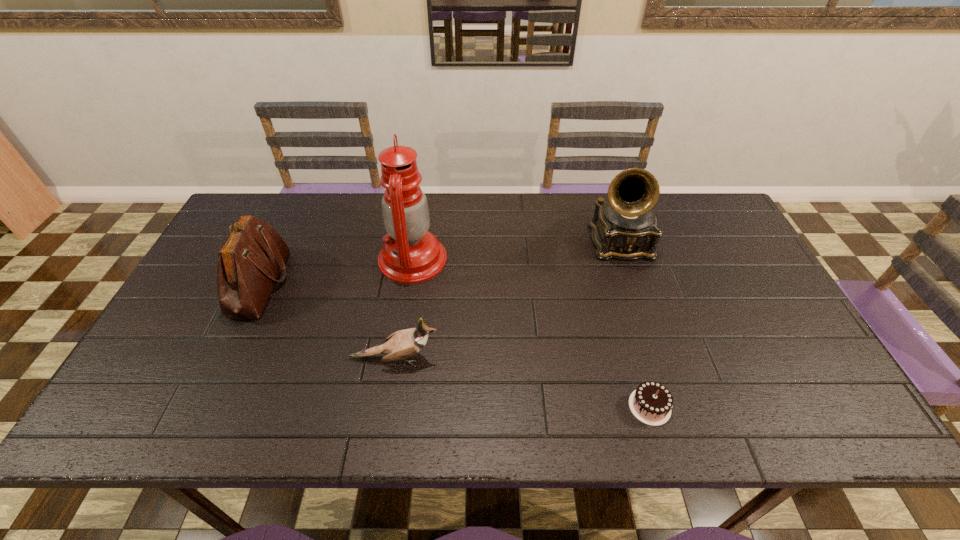
Identify the location of the tallest object. (410, 254).

Image resolution: width=960 pixels, height=540 pixels. I want to click on phonograph record, so click(x=625, y=227).

This screenshot has width=960, height=540. What are the coordinates of `the leftmost object` in the screenshot? It's located at (251, 259).

Locate an element on the screen. The image size is (960, 540). the third shortest object is located at coordinates (251, 259).

Where is `the fourth tallest object`? The height and width of the screenshot is (540, 960). the fourth tallest object is located at coordinates (402, 344).

This screenshot has height=540, width=960. I want to click on the second nearest object, so click(x=402, y=344).

Locate an element on the screen. The height and width of the screenshot is (540, 960). chocolate cake is located at coordinates (651, 403).

I want to click on the nearest object, so click(651, 403).

Identify the location of vacant space located 0.080m on the left of the oil lamp. (351, 259).

Find the location of `free point located on the horn of the second tallest object`. free point located on the horn of the second tallest object is located at coordinates (648, 332).